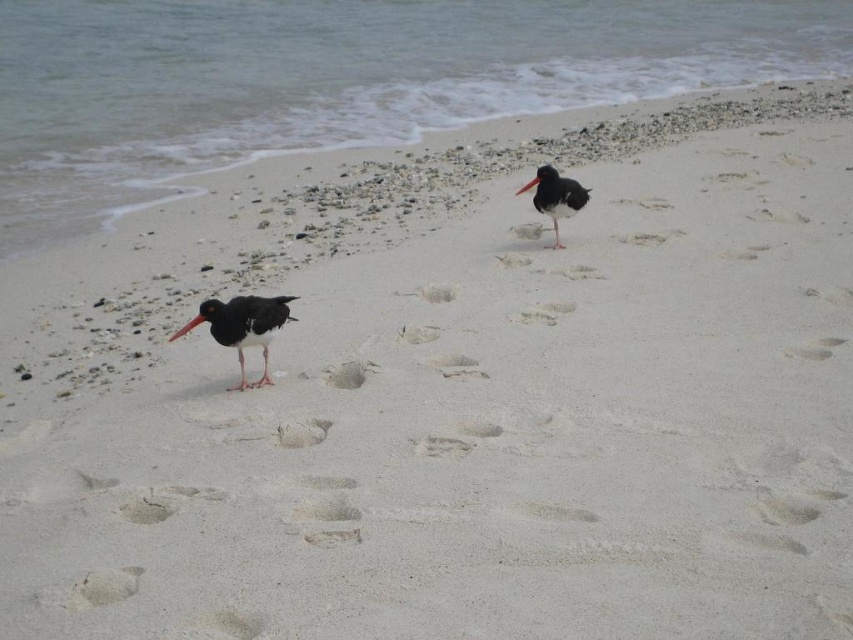
Which of these two, matte black beak at lower left or black matte beak at upper right, stands shorter?

With less height is matte black beak at lower left.

Who is taller, matte black beak at lower left or black matte beak at upper right?

With more height is black matte beak at upper right.

Does point (181, 332) come in front of point (524, 192)?

Yes, point (181, 332) is in front of point (524, 192).

Where is `matte black beak at lower left`? The image size is (853, 640). matte black beak at lower left is located at coordinates click(x=187, y=326).

Does black glossy bird at center have a larger size compared to black matte beak at upper right?

Yes, black glossy bird at center is bigger than black matte beak at upper right.

Does point (538, 188) come farther from viewer compared to point (535, 177)?

That is False.

The image size is (853, 640). Find the location of `black glossy bird at center`. black glossy bird at center is located at coordinates (555, 196).

Between black glossy oystercatcher at center and matte black beak at lower left, which one is positioned lower?

black glossy oystercatcher at center is below.

Which of these two, black glossy oystercatcher at center or matte black beak at lower left, stands taller?

black glossy oystercatcher at center

Who is more distant from viewer, (260, 307) or (183, 333)?

The point (260, 307) is behind.

Identify the location of black glossy oystercatcher at center. The width and height of the screenshot is (853, 640). (x=242, y=326).